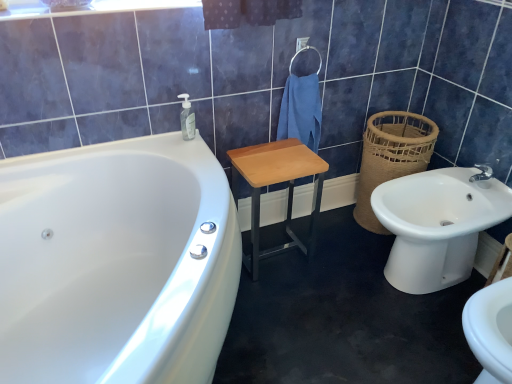
Identify the location of vacant space positioned to the left of translucent plastic soap dispenser at upper left. Image resolution: width=512 pixels, height=384 pixels. (155, 140).